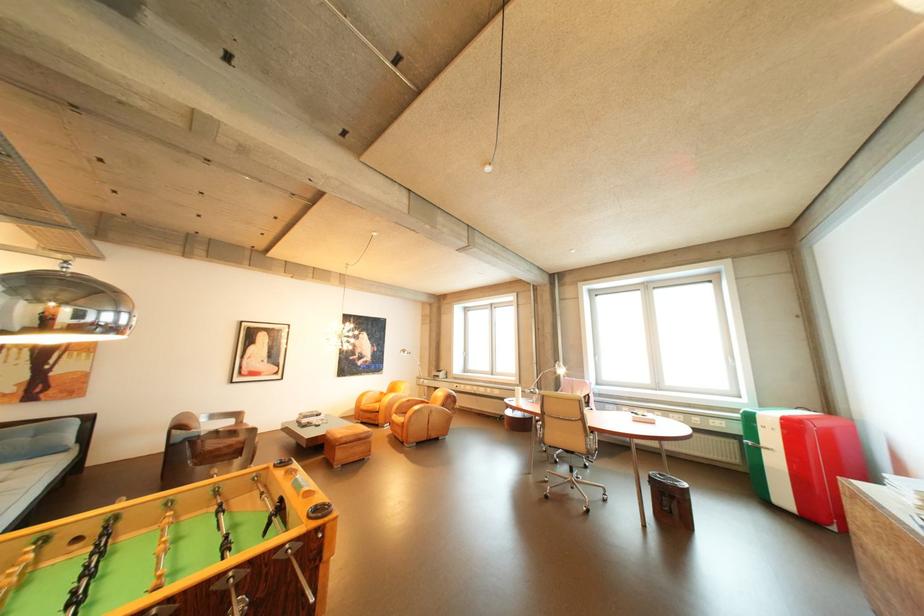
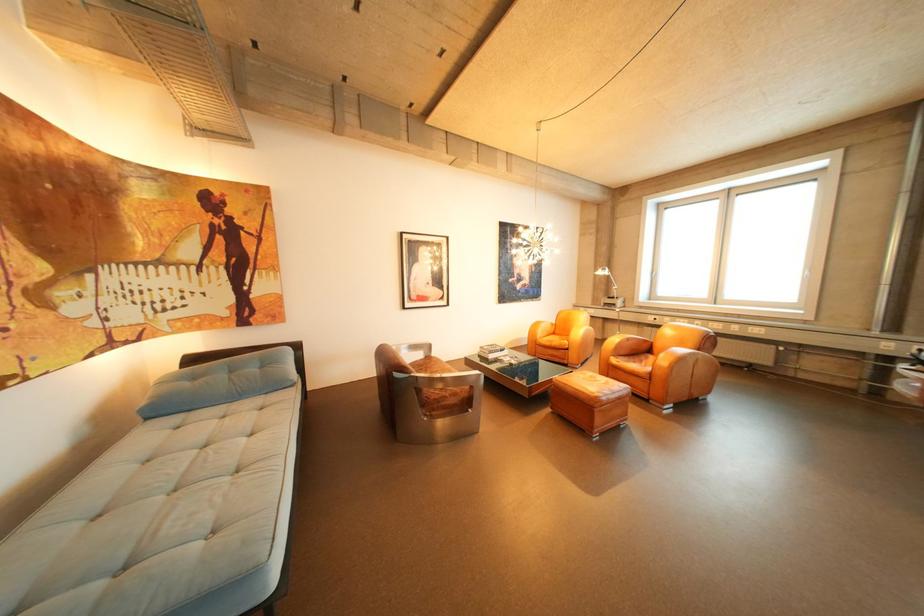
In a continuous first-person perspective shot, in which direction is the camera moving?

The movement direction of the cameraman is left, forward.